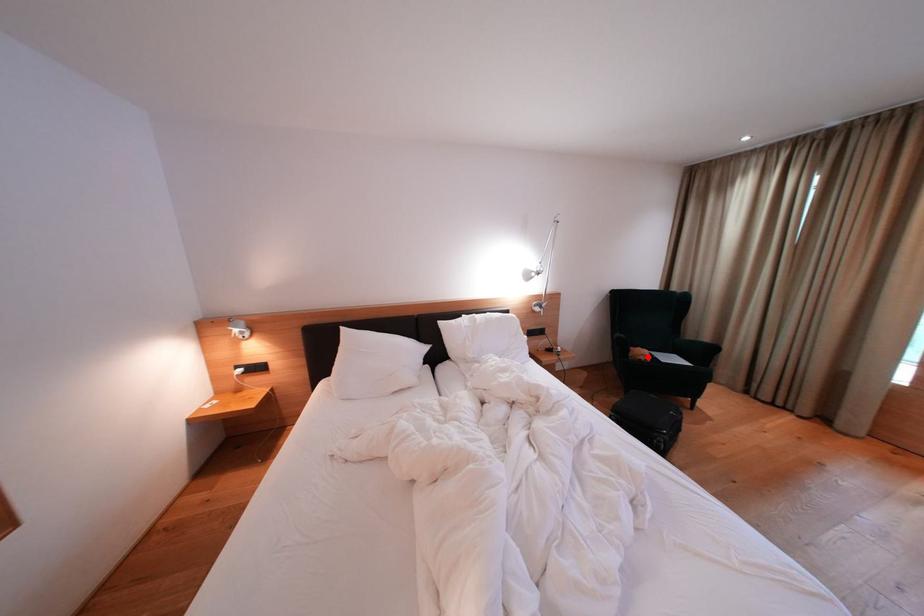
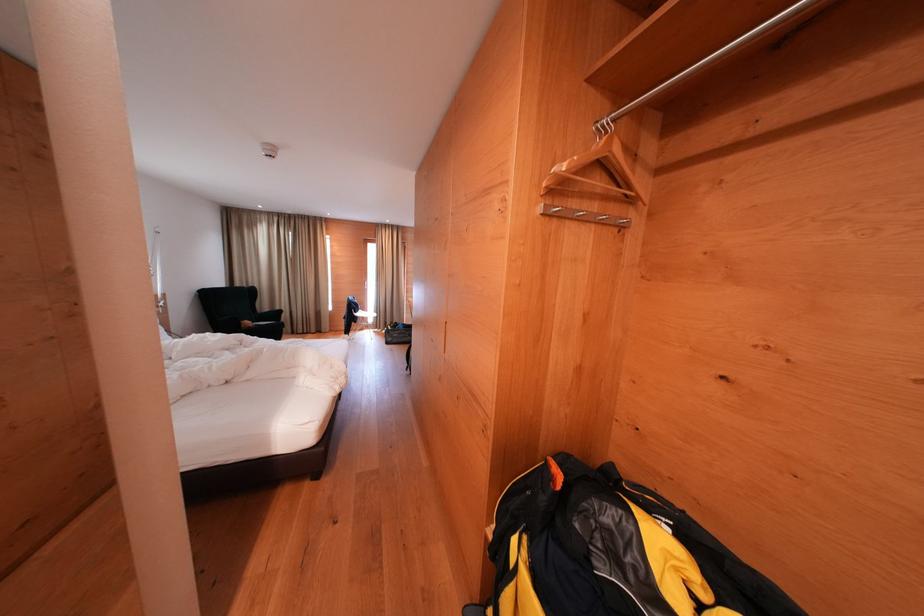
Question: I am providing you with two images of the same scene from different viewpoints. A red point is shown in image1. For the corresponding object point in image2, is it positioned nearer or farther from the camera?

Choices:
 (A) Nearer
 (B) Farther

Answer: (A)